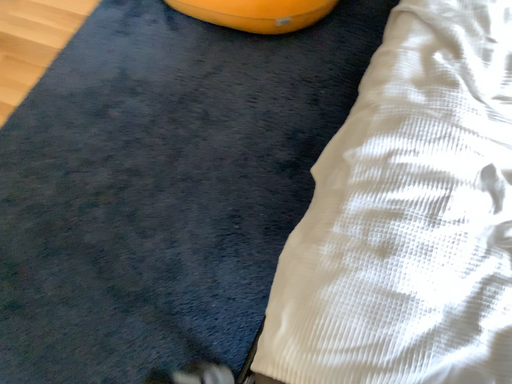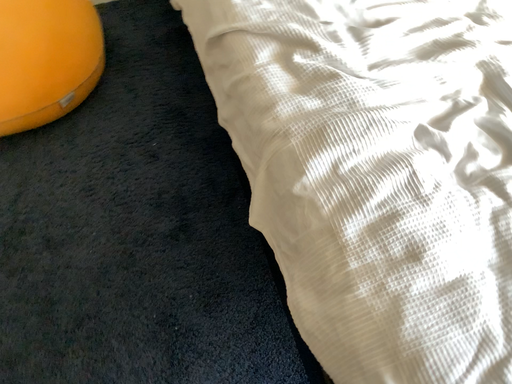
Question: How did the camera likely rotate when shooting the video?

Choices:
 (A) rotated left
 (B) rotated right

Answer: (B)